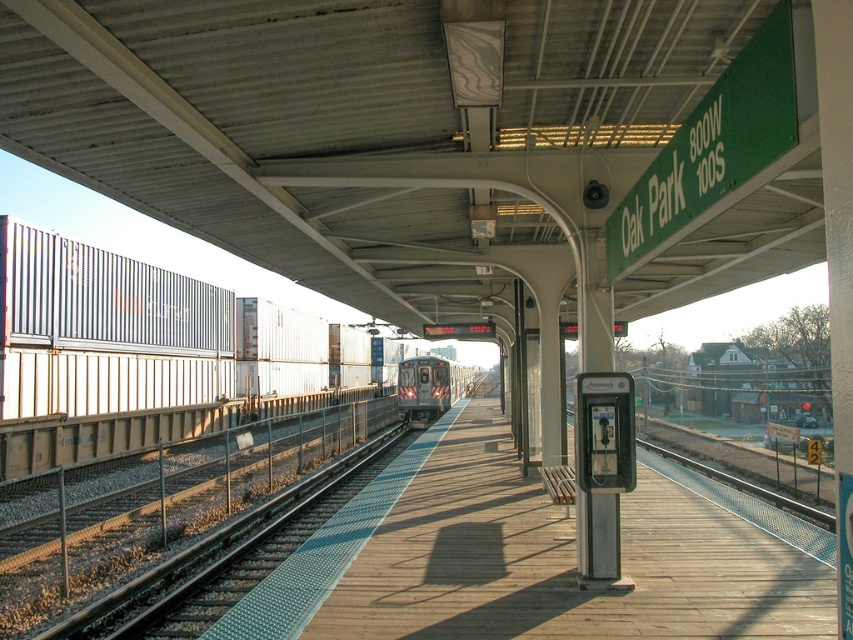
Can you confirm if wooden platform at center is thinner than silver metallic train at center?

Incorrect, wooden platform at center's width is not less than silver metallic train at center's.

What do you see at coordinates (525, 560) in the screenshot?
I see `wooden platform at center` at bounding box center [525, 560].

Image resolution: width=853 pixels, height=640 pixels. Identify the location of wooden platform at center. (525, 560).